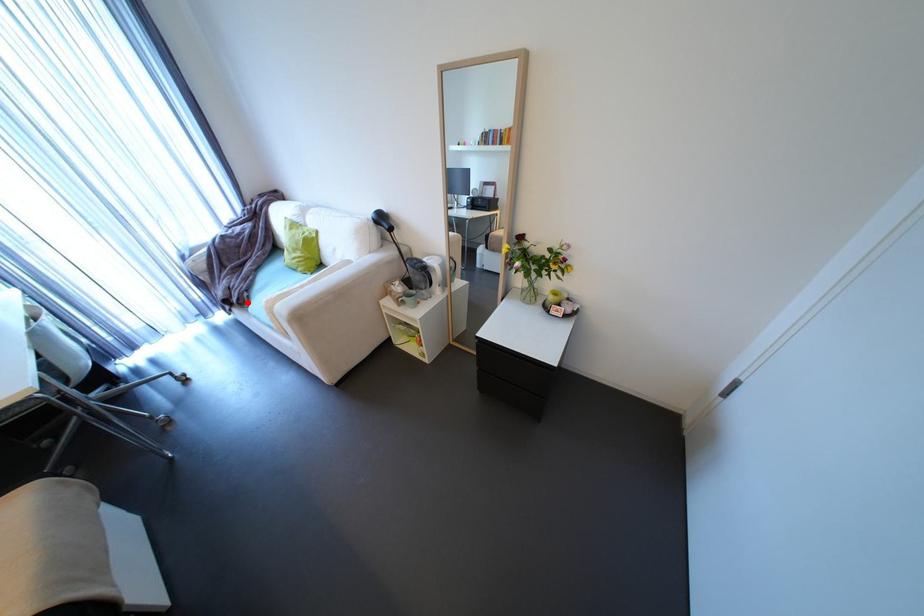
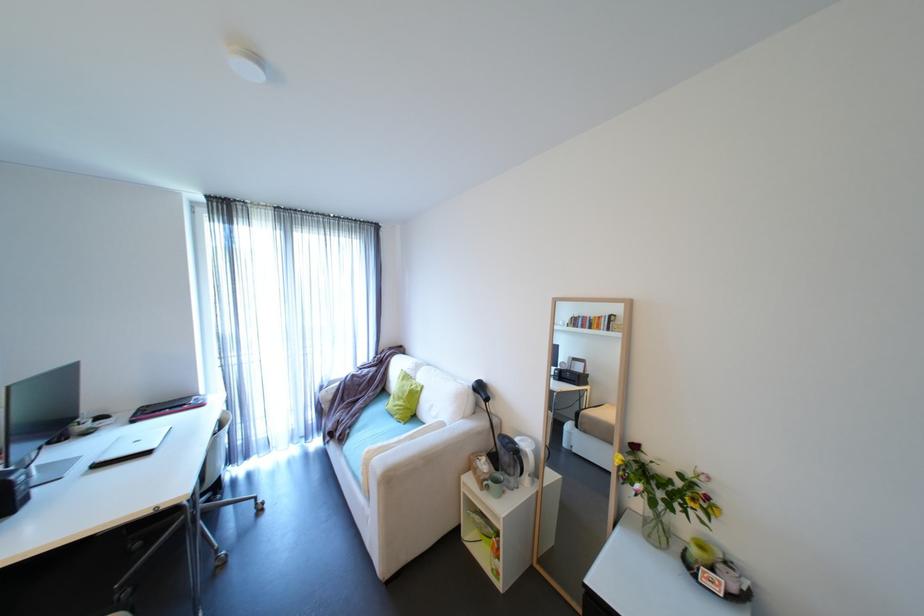
Question: I am providing you with two images of the same scene from different viewpoints. Image1 has a red point marked. In image2, the corresponding 3D location appears at what relative position? Reply with the corresponding letter.

Choices:
 (A) Closer
 (B) Farther

Answer: (A)